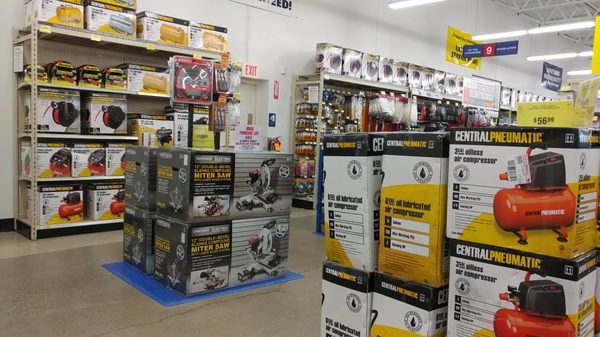
Locate an element on the screen. This screenshot has width=600, height=337. fire extinguisher is located at coordinates (273, 143).